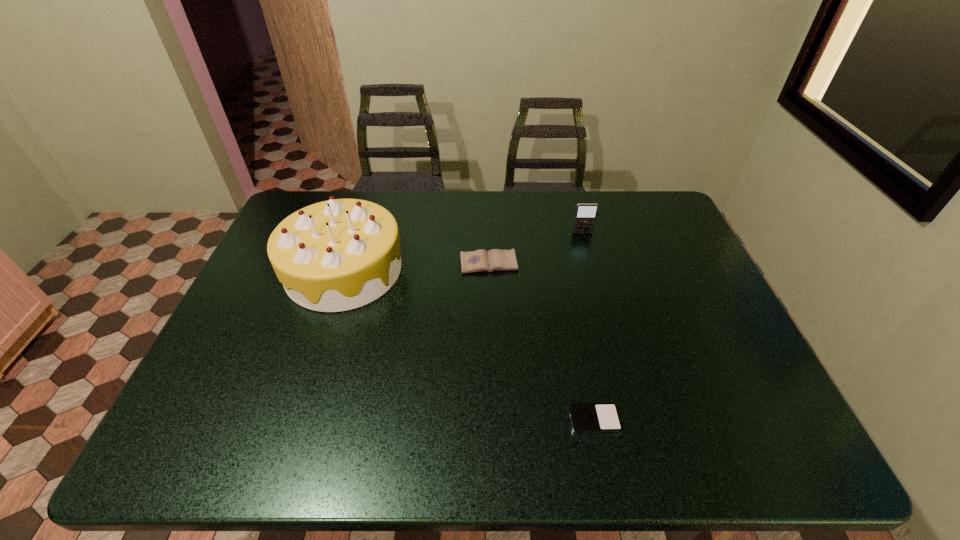
The width and height of the screenshot is (960, 540). What are the coordinates of `birthday cake` in the screenshot? It's located at (340, 254).

The width and height of the screenshot is (960, 540). What are the coordinates of `the tallest object` in the screenshot? It's located at pos(340,254).

Image resolution: width=960 pixels, height=540 pixels. I want to click on the taller iPod, so click(585, 215).

Where is `the farther iPod`? The image size is (960, 540). the farther iPod is located at coordinates (585, 215).

The height and width of the screenshot is (540, 960). Find the location of `the third tallest object`. the third tallest object is located at coordinates (480, 260).

Where is `the third object from right to left`? Image resolution: width=960 pixels, height=540 pixels. the third object from right to left is located at coordinates (480, 260).

Where is `the nearest object`? The image size is (960, 540). the nearest object is located at coordinates (585, 417).

Locate an element on the screen. The width and height of the screenshot is (960, 540). the shortest object is located at coordinates (585, 417).

The width and height of the screenshot is (960, 540). In order to click on free space located on the back of the leftmost object in this screenshot , I will do (370, 191).

This screenshot has height=540, width=960. Find the location of `vacant space located 0.340m on the front-facing side of the third shortest object`. vacant space located 0.340m on the front-facing side of the third shortest object is located at coordinates (604, 312).